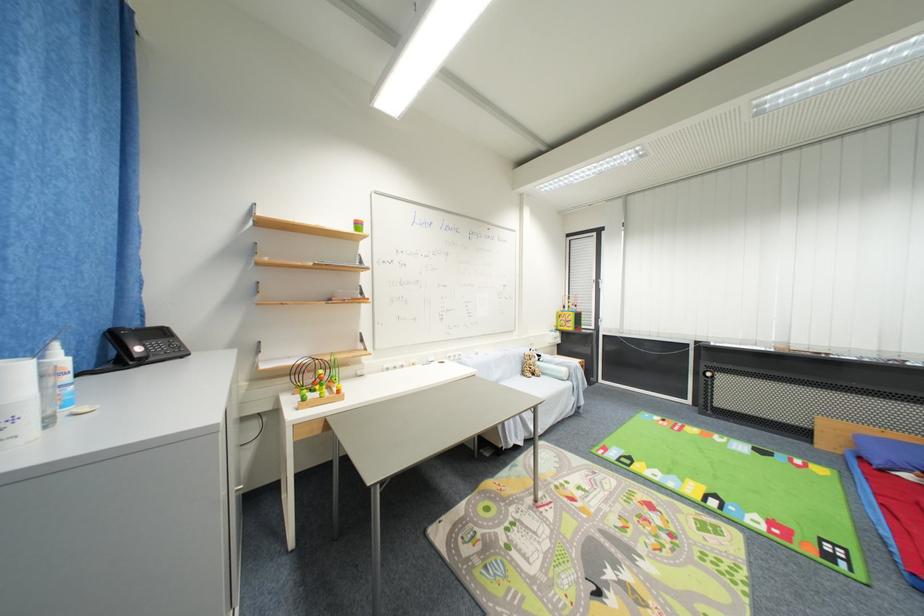
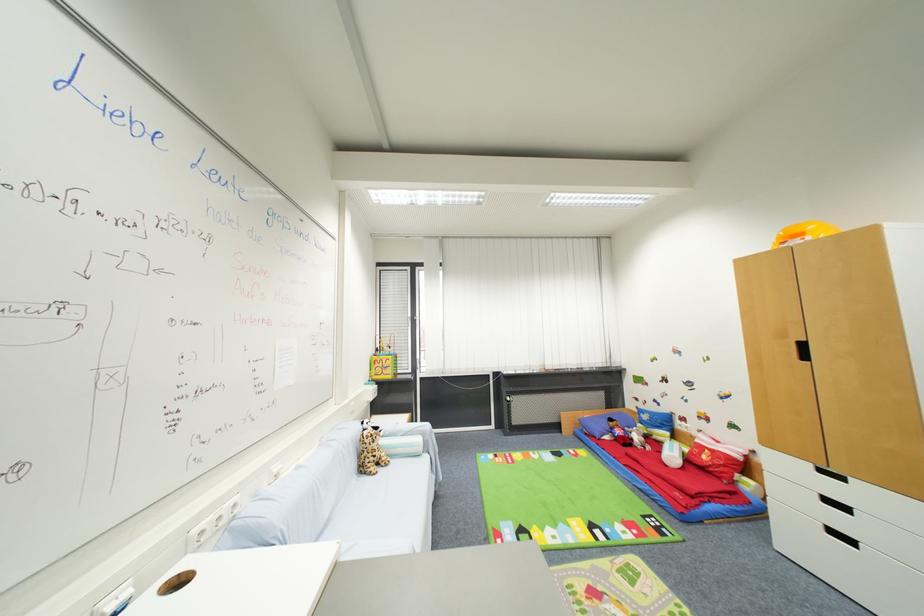
Where in the second image is the point corresponding to (528,376) from the first image?

(367, 472)